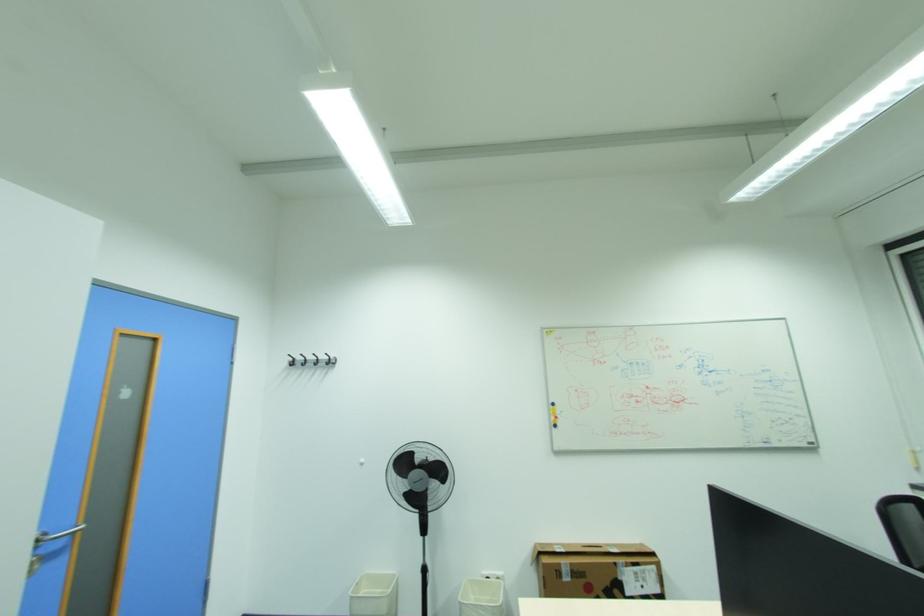
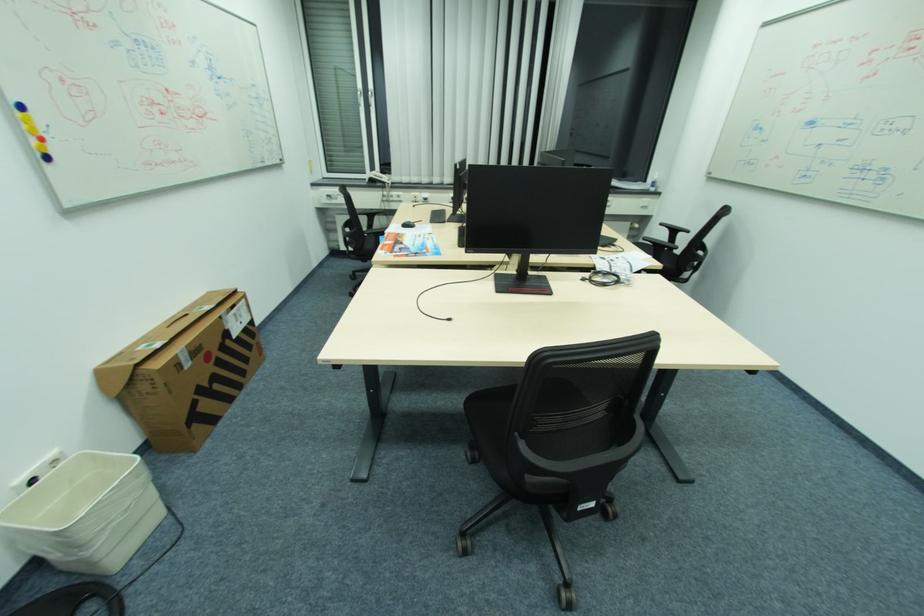
In the second image, find the point that corresponds to (561,426) in the first image.

(52, 158)